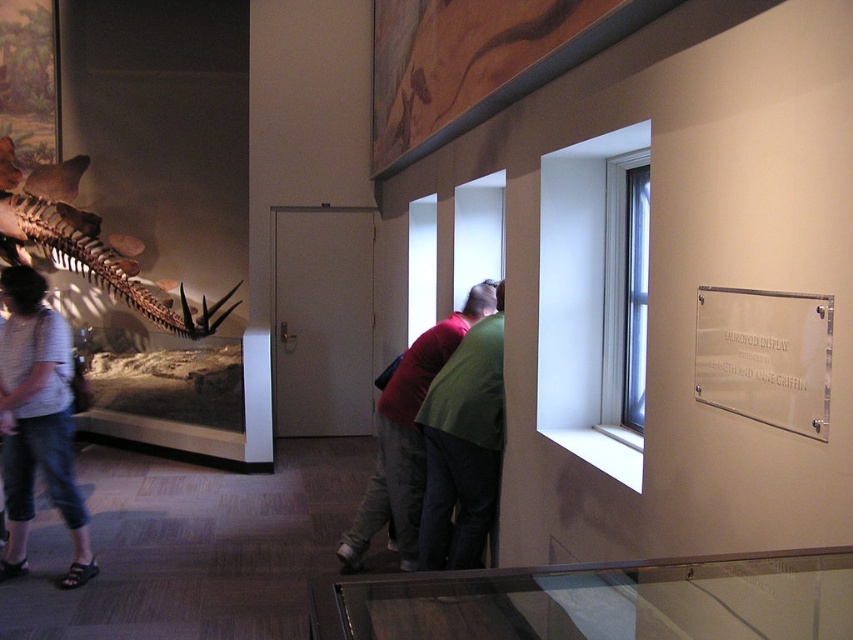
Question: Which point appears farthest from the camera in this image?

Choices:
 (A) (482, 300)
 (B) (10, 534)
 (C) (51, 248)

Answer: (C)

Question: Is denim shorts at lower left thinner than green fabric shirt at center?

Choices:
 (A) yes
 (B) no

Answer: (A)

Question: Which of these objects is positioned farthest from the matte brown skeleton at left?

Choices:
 (A) green fabric shirt at center
 (B) denim shorts at lower left

Answer: (A)

Question: Which of the following is the farthest from the observer?

Choices:
 (A) (25, 342)
 (B) (381, 502)

Answer: (B)

Question: Can you confirm if denim shorts at lower left is positioned to the right of matte brown skeleton at left?

Choices:
 (A) no
 (B) yes

Answer: (B)

Question: Is denim shorts at lower left to the left of matte brown skeleton at left from the viewer's perspective?

Choices:
 (A) no
 (B) yes

Answer: (A)